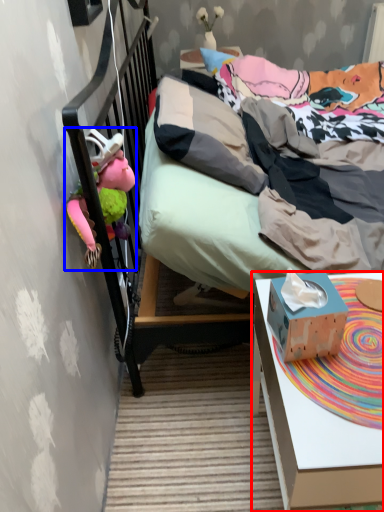
Question: Which point is further to the camera, desk (highlighted by a red box) or toy (highlighted by a blue box)?

Choices:
 (A) desk
 (B) toy

Answer: (B)